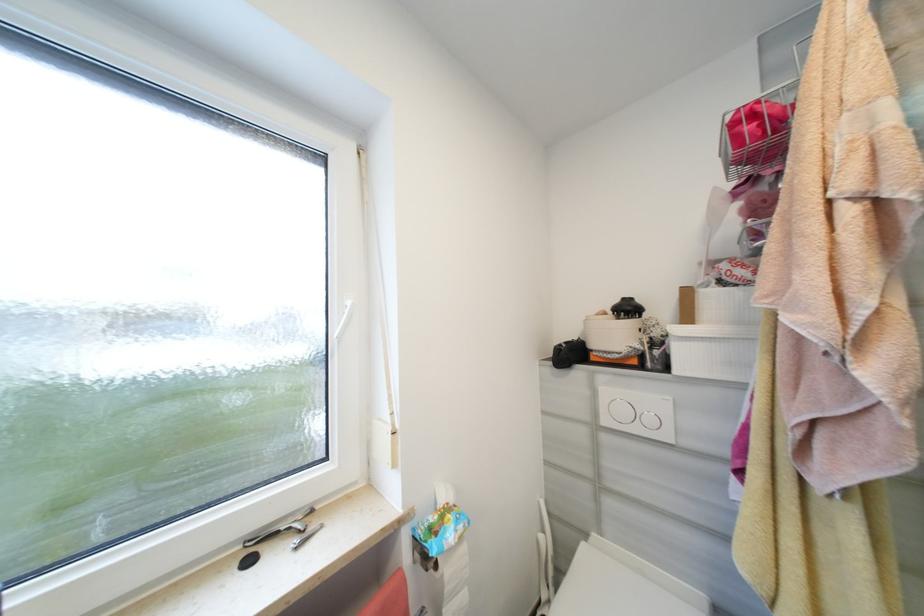
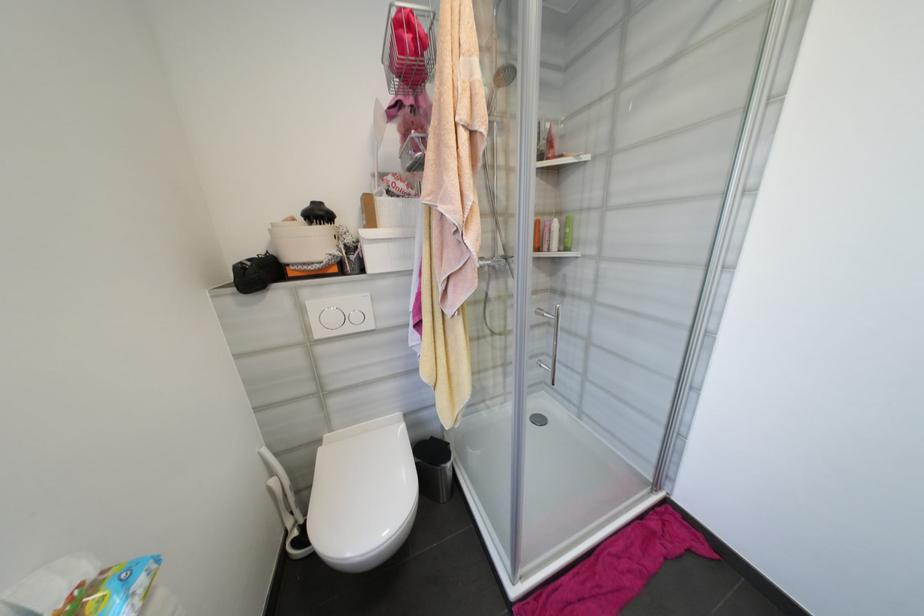
Where in the second image is the point corresponding to [655,421] from the first image?

(361, 318)